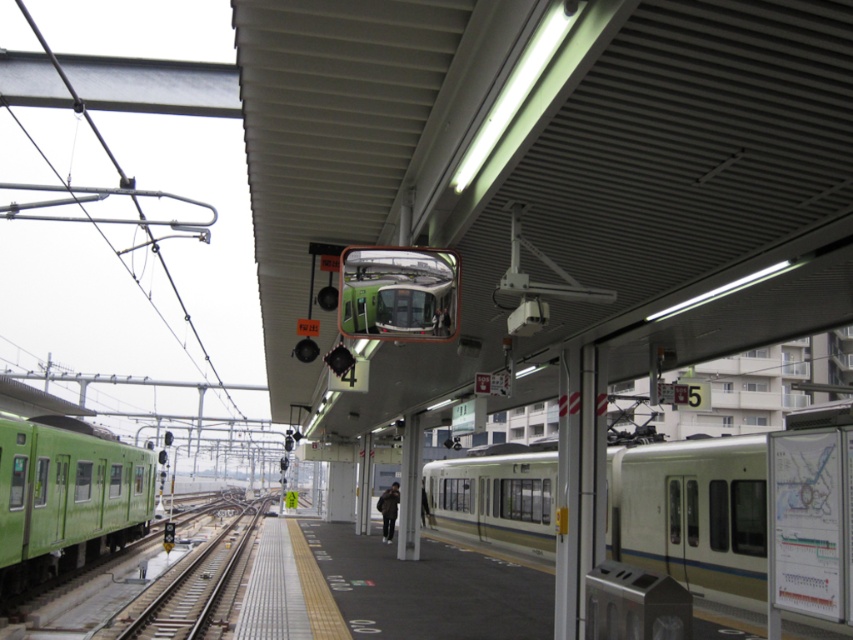
You are a passenger on the platform and need to board the nearest train. Which train should you head towards, the silver metallic train at right or the green matte train at left?

The green matte train at left is closer to you since it is smaller in size than the silver metallic train at right, which is larger and farther away.

You are standing at the center of the platform and want to board the silver metallic train at right. Which direction should you walk to reach it?

You should walk to the right to reach the silver metallic train at right since it is located at the right side of the platform.